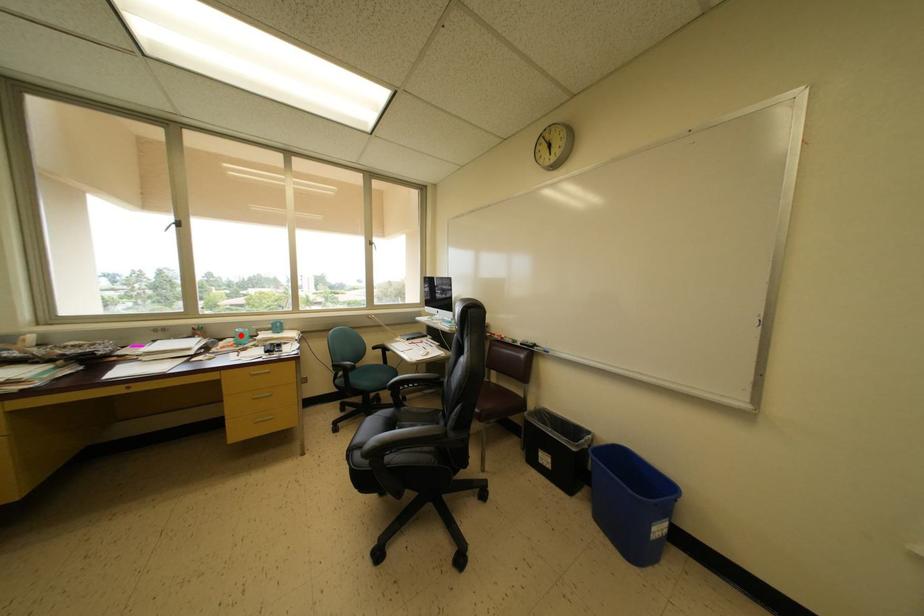
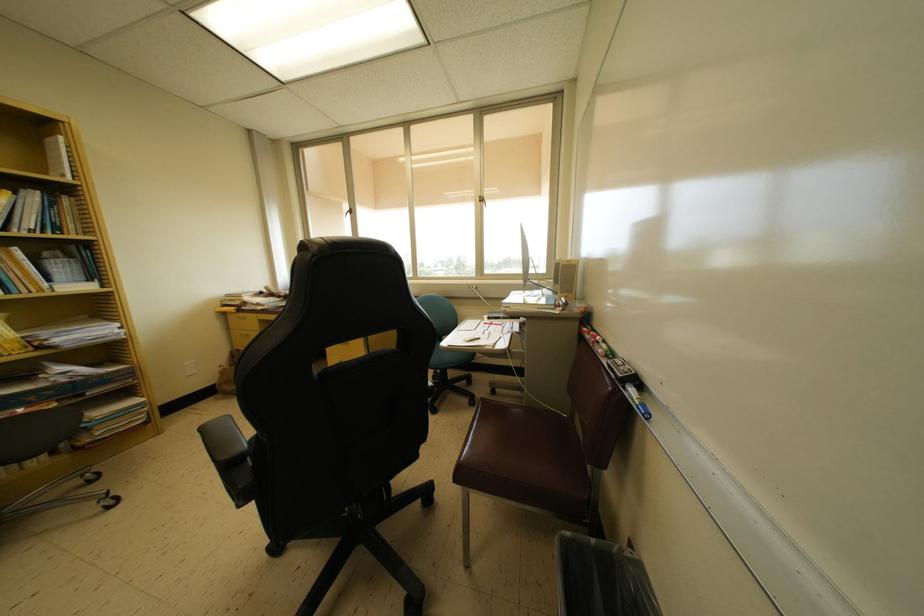
Question: I am providing you with two images of the same scene from different viewpoints. A red point is marked on the first image. At the location where the point appears in image 1, is it still visible in image 2?

Choices:
 (A) Yes
 (B) No

Answer: (B)